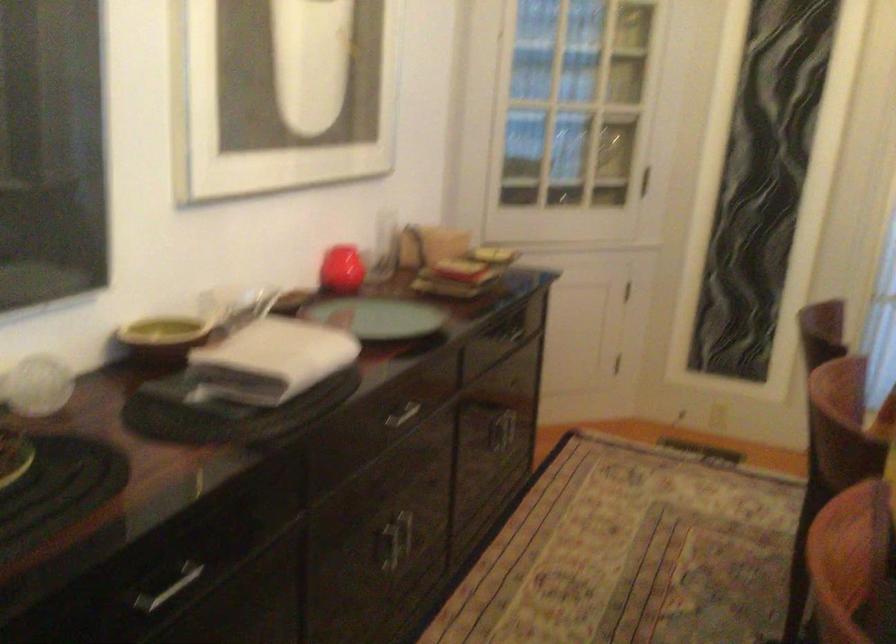
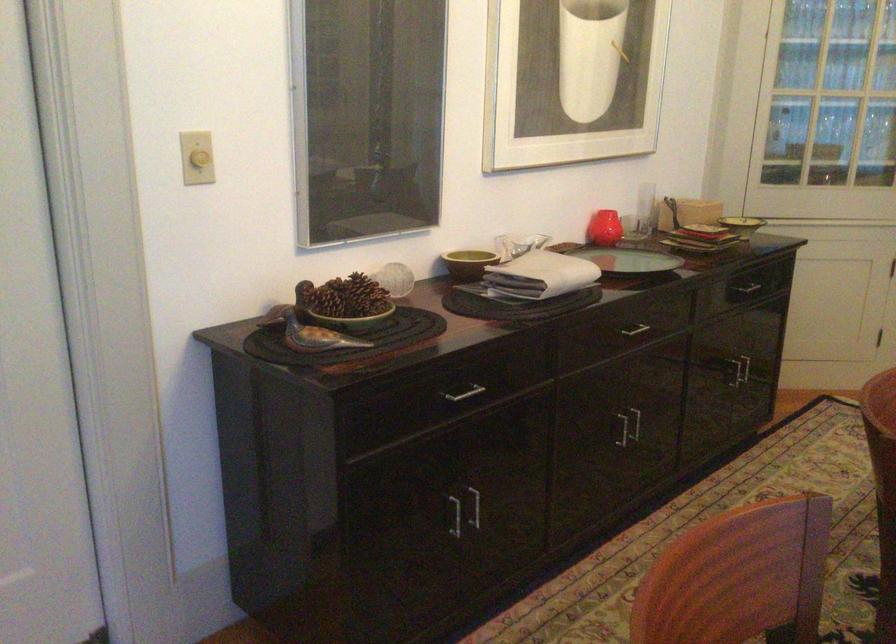
Where in the second image is the point corresponding to pixel 376 237 from the first image?

(645, 207)